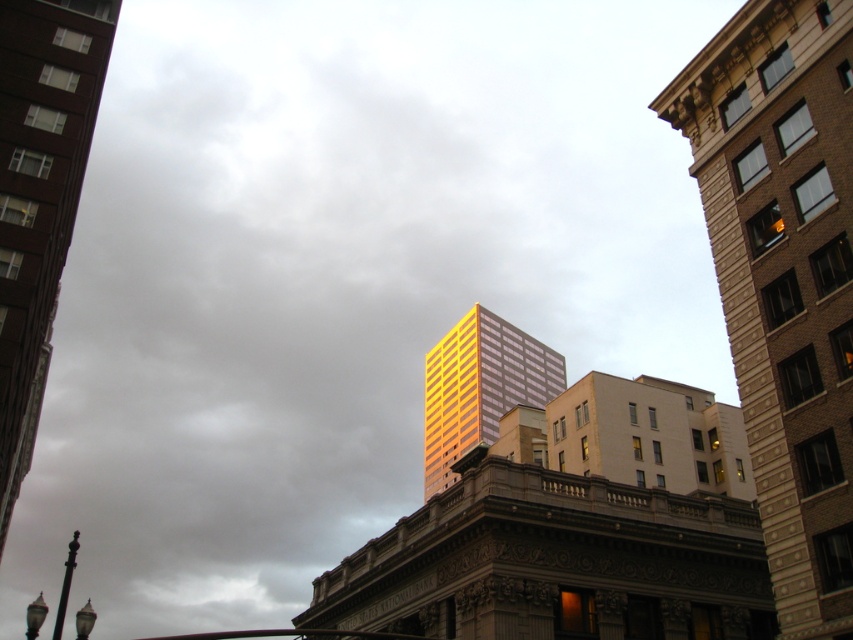
Is gold glass skyscraper at center above gold reflective glass building at center?

Yes.

Consider the image. Which is more to the right, gold glass skyscraper at center or gold reflective glass building at center?

Positioned to the right is gold glass skyscraper at center.

Which is in front, point (770, 483) or point (486, 348)?

Point (770, 483) is in front.

Identify the location of gold glass skyscraper at center. Image resolution: width=853 pixels, height=640 pixels. (784, 276).

Does gold glass skyscraper at center appear on the right side of gold reflective glass skyscraper at center?

Yes, gold glass skyscraper at center is to the right of gold reflective glass skyscraper at center.

Measure the distance between gold glass skyscraper at center and gold reflective glass skyscraper at center.

gold glass skyscraper at center is 50.05 meters from gold reflective glass skyscraper at center.

Is point (824, 51) in front of point (3, 67)?

That is True.

At what (x,y) coordinates should I click in order to perform the action: click on gold glass skyscraper at center. Please return your answer as a coordinate pair (x, y). Looking at the image, I should click on (784, 276).

How far apart are gold reflective glass skyscraper at center and gold reflective glass building at center?

117.90 meters

What are the coordinates of `gold reflective glass skyscraper at center` in the screenshot? It's located at (x=39, y=195).